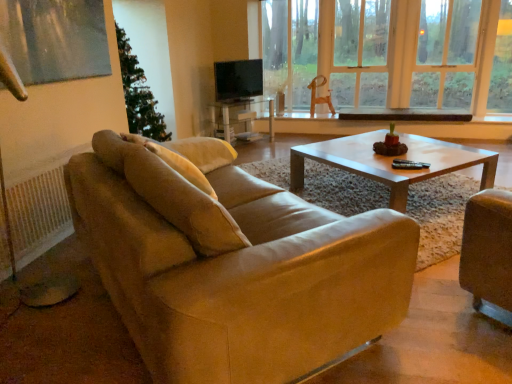
Question: Considering the relative positions of matte black tv at center and beige fabric pillow at upper left in the image provided, is matte black tv at center to the left of beige fabric pillow at upper left from the viewer's perspective?

Choices:
 (A) yes
 (B) no

Answer: (B)

Question: From a real-world perspective, is matte black tv at center on beige fabric pillow at upper left?

Choices:
 (A) no
 (B) yes

Answer: (B)

Question: Is matte black tv at center not close to beige fabric pillow at upper left?

Choices:
 (A) no
 (B) yes

Answer: (B)

Question: From the image's perspective, is matte black tv at center on beige fabric pillow at upper left?

Choices:
 (A) no
 (B) yes

Answer: (B)

Question: Considering the relative sizes of matte black tv at center and beige fabric pillow at upper left in the image provided, is matte black tv at center thinner than beige fabric pillow at upper left?

Choices:
 (A) no
 (B) yes

Answer: (B)

Question: Looking at their shapes, would you say transparent glass window at center is wider or thinner than wooden swivel chair at center?

Choices:
 (A) wide
 (B) thin

Answer: (A)

Question: From the image's perspective, is transparent glass window at center above or below wooden swivel chair at center?

Choices:
 (A) above
 (B) below

Answer: (A)

Question: Is point (350, 51) positioned closer to the camera than point (315, 82)?

Choices:
 (A) closer
 (B) farther

Answer: (B)

Question: Would you say transparent glass window at center is inside or outside wooden swivel chair at center?

Choices:
 (A) outside
 (B) inside

Answer: (A)

Question: Looking at their shapes, would you say matte black tv at center is wider or thinner than wooden swivel chair at center?

Choices:
 (A) wide
 (B) thin

Answer: (B)

Question: In the image, is matte black tv at center positioned in front of or behind wooden swivel chair at center?

Choices:
 (A) behind
 (B) front

Answer: (B)

Question: Is matte black tv at center inside or outside of wooden swivel chair at center?

Choices:
 (A) inside
 (B) outside

Answer: (B)

Question: From the image's perspective, is matte black tv at center positioned above or below wooden swivel chair at center?

Choices:
 (A) above
 (B) below

Answer: (A)

Question: Based on their sizes in the image, would you say black plastic corded phone at center is bigger or smaller than beige fabric pillow at upper left?

Choices:
 (A) big
 (B) small

Answer: (B)

Question: From the image's perspective, is black plastic corded phone at center positioned above or below beige fabric pillow at upper left?

Choices:
 (A) below
 (B) above

Answer: (A)